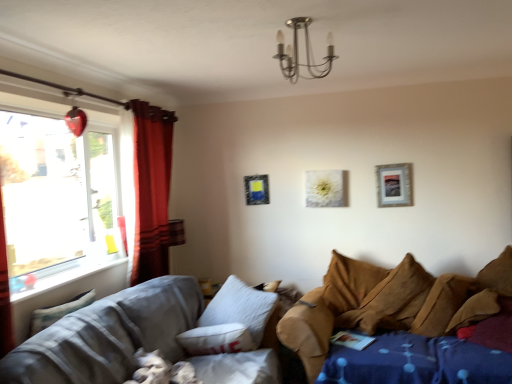
Locate an element on the screen. Image resolution: width=512 pixels, height=384 pixels. brown textured pillow at right, acting as the 1th pillow starting from the back is located at coordinates (498, 274).

Locate an element on the screen. The height and width of the screenshot is (384, 512). brown fabric couch at lower right, which is the first studio couch in right-to-left order is located at coordinates (388, 303).

The width and height of the screenshot is (512, 384). I want to click on white painted wood at left, so (x=68, y=276).

Identify the location of white matte canvas at center, which is the 1th picture frame in back-to-front order. (325, 188).

The height and width of the screenshot is (384, 512). What do you see at coordinates (151, 189) in the screenshot? I see `red velvet curtain at left` at bounding box center [151, 189].

Where is `silver metallic picture frame at upper right, the second picture frame positioned from the back`? silver metallic picture frame at upper right, the second picture frame positioned from the back is located at coordinates (394, 185).

Is textured gray fabric couch at lower left, which ranks as the 1th studio couch in left-to-right order, at the back of metallic chandelier at upper center?

No, metallic chandelier at upper center's orientation is not away from textured gray fabric couch at lower left, which ranks as the 1th studio couch in left-to-right order.

Is point (290, 64) behind point (249, 380)?

No.

What's the angular difference between metallic chandelier at upper center and textured gray fabric couch at lower left, which ranks as the 1th studio couch in left-to-right order,'s facing directions?

The angle between the facing direction of metallic chandelier at upper center and the facing direction of textured gray fabric couch at lower left, which ranks as the 1th studio couch in left-to-right order, is 0.819 degrees.

Can you confirm if metallic chandelier at upper center is bigger than textured gray fabric couch at lower left, which is counted as the 2th studio couch, starting from the right?

No.

Is brown textured pillow at right, acting as the 1th pillow starting from the back, wider or thinner than white matte canvas at center, which is the 1th picture frame in back-to-front order?

Considering their sizes, brown textured pillow at right, acting as the 1th pillow starting from the back, looks broader than white matte canvas at center, which is the 1th picture frame in back-to-front order.

Is brown textured pillow at right, which appears as the second pillow when viewed from the front, inside the boundaries of white matte canvas at center, arranged as the second picture frame when viewed from the front, or outside?

brown textured pillow at right, which appears as the second pillow when viewed from the front, lies outside white matte canvas at center, arranged as the second picture frame when viewed from the front.

Is brown textured pillow at right, acting as the 1th pillow starting from the back, smaller than white matte canvas at center, arranged as the second picture frame when viewed from the front?

Incorrect, brown textured pillow at right, acting as the 1th pillow starting from the back, is not smaller in size than white matte canvas at center, arranged as the second picture frame when viewed from the front.

Is brown textured pillow at right, the 1th pillow in the right-to-left sequence, turned away from white matte canvas at center, arranged as the second picture frame when viewed from the front?

No, brown textured pillow at right, the 1th pillow in the right-to-left sequence, is not facing away from white matte canvas at center, arranged as the second picture frame when viewed from the front.

Is white matte canvas at center, which ranks as the second picture frame in right-to-left order, bigger than brown textured pillow at right, marked as the 2th pillow in a left-to-right arrangement?

Actually, white matte canvas at center, which ranks as the second picture frame in right-to-left order, might be smaller than brown textured pillow at right, marked as the 2th pillow in a left-to-right arrangement.

From a real-world perspective, which is physically above, white matte canvas at center, which ranks as the second picture frame in right-to-left order, or brown textured pillow at right, acting as the 1th pillow starting from the back?

white matte canvas at center, which ranks as the second picture frame in right-to-left order.

How different are the orientations of white matte canvas at center, which ranks as the second picture frame in right-to-left order, and brown textured pillow at right, which appears as the second pillow when viewed from the front, in degrees?

They differ by 32.5 degrees in their facing directions.

Considering the relative sizes of white matte canvas at center, which is the 1th picture frame in left-to-right order, and brown textured pillow at right, marked as the 2th pillow in a left-to-right arrangement, in the image provided, is white matte canvas at center, which is the 1th picture frame in left-to-right order, shorter than brown textured pillow at right, marked as the 2th pillow in a left-to-right arrangement,?

Yes, white matte canvas at center, which is the 1th picture frame in left-to-right order, is shorter than brown textured pillow at right, marked as the 2th pillow in a left-to-right arrangement.

Is silver metallic picture frame at upper right, which ranks as the 1th picture frame in right-to-left order, aimed at textured gray fabric couch at lower left, which ranks as the 1th studio couch in left-to-right order?

No, silver metallic picture frame at upper right, which ranks as the 1th picture frame in right-to-left order, is not aimed at textured gray fabric couch at lower left, which ranks as the 1th studio couch in left-to-right order.

Is silver metallic picture frame at upper right, the second picture frame positioned from the back, not near textured gray fabric couch at lower left, which is counted as the 2th studio couch, starting from the right?

Yes, silver metallic picture frame at upper right, the second picture frame positioned from the back, is far from textured gray fabric couch at lower left, which is counted as the 2th studio couch, starting from the right.

Where is `the 1st studio couch below the silver metallic picture frame at upper right, the 1th picture frame positioned from the front (from a real-world perspective)`? This screenshot has width=512, height=384. the 1st studio couch below the silver metallic picture frame at upper right, the 1th picture frame positioned from the front (from a real-world perspective) is located at coordinates (130, 341).

Looking at their sizes, would you say silver metallic picture frame at upper right, the 1th picture frame positioned from the front, is wider or thinner than textured gray fabric couch at lower left, which is counted as the 2th studio couch, starting from the right?

Considering their sizes, silver metallic picture frame at upper right, the 1th picture frame positioned from the front, looks slimmer than textured gray fabric couch at lower left, which is counted as the 2th studio couch, starting from the right.

Is point (145, 123) more distant than point (56, 285)?

Yes, it is.

Based on their positions, is red velvet curtain at left located to the left or right of white painted wood at left?

red velvet curtain at left is to the right of white painted wood at left.

Where is `curtain above the white painted wood at left (from the image's perspective)`? The height and width of the screenshot is (384, 512). curtain above the white painted wood at left (from the image's perspective) is located at coordinates (151, 189).

Would you say red velvet curtain at left is outside white painted wood at left?

Yes, red velvet curtain at left is located beyond the bounds of white painted wood at left.

Can you confirm if brown fabric couch at lower right, which is the first studio couch in right-to-left order, is taller than silver metallic picture frame at upper right, the 1th picture frame positioned from the front?

Yes, brown fabric couch at lower right, which is the first studio couch in right-to-left order, is taller than silver metallic picture frame at upper right, the 1th picture frame positioned from the front.

Is silver metallic picture frame at upper right, placed as the second picture frame when sorted from left to right, at the back of brown fabric couch at lower right, arranged as the 2th studio couch when viewed from the left?

No, brown fabric couch at lower right, arranged as the 2th studio couch when viewed from the left, is not facing the opposite direction of silver metallic picture frame at upper right, placed as the second picture frame when sorted from left to right.

Considering the positions of points (336, 282) and (404, 169), is point (336, 282) farther from camera compared to point (404, 169)?

No, (336, 282) is in front of (404, 169).

Between brown fabric couch at lower right, which is the first studio couch in right-to-left order, and silver metallic picture frame at upper right, the second picture frame positioned from the back, which one appears on the right side from the viewer's perspective?

Positioned to the right is silver metallic picture frame at upper right, the second picture frame positioned from the back.

Which is behind, point (153, 121) or point (331, 189)?

The point (331, 189) is more distant.

From the image's perspective, is red velvet curtain at left located beneath white matte canvas at center, which ranks as the second picture frame in right-to-left order?

Indeed, from the image's perspective, red velvet curtain at left is shown beneath white matte canvas at center, which ranks as the second picture frame in right-to-left order.

From a real-world perspective, is red velvet curtain at left above or below white matte canvas at center, arranged as the second picture frame when viewed from the front?

red velvet curtain at left is situated higher than white matte canvas at center, arranged as the second picture frame when viewed from the front, in the real world.

Between red velvet curtain at left and white matte canvas at center, which is the 1th picture frame in left-to-right order, which one has smaller width?

white matte canvas at center, which is the 1th picture frame in left-to-right order, is thinner.

Find the location of a particular element. light fixture behind the textured gray fabric couch at lower left, which ranks as the 1th studio couch in left-to-right order is located at coordinates pos(305,52).

Locate an element on the screen. This screenshot has height=384, width=512. picture frame that is the 2nd object to the left of the brown textured pillow at right, acting as the 1th pillow starting from the back, starting at the anchor is located at coordinates (325, 188).

Which object lies nearer to the anchor point textured gray fabric couch at lower left, which is counted as the 2th studio couch, starting from the right, silver metallic picture frame at upper right, the second picture frame positioned from the back, or brown textured pillow at right, which appears as the second pillow when viewed from the front?

silver metallic picture frame at upper right, the second picture frame positioned from the back, is closer to textured gray fabric couch at lower left, which is counted as the 2th studio couch, starting from the right.

Which object lies nearer to the anchor point red velvet curtain at left, brown textured pillow at right, acting as the 1th pillow starting from the back, or metallic chandelier at upper center?

Among the two, metallic chandelier at upper center is located nearer to red velvet curtain at left.

Consider the image. Which object lies nearer to the anchor point white matte canvas at center, which is the 1th picture frame in back-to-front order, red velvet curtain at left or brown textured pillow at right, which appears as the second pillow when viewed from the front?

brown textured pillow at right, which appears as the second pillow when viewed from the front, is positioned closer to the anchor white matte canvas at center, which is the 1th picture frame in back-to-front order.

Looking at the image, which one is located closer to white painted wood at left, textured gray fabric couch at lower left, which ranks as the 1th studio couch in left-to-right order, or brown fabric couch at lower right, arranged as the 2th studio couch when viewed from the left?

The object closer to white painted wood at left is textured gray fabric couch at lower left, which ranks as the 1th studio couch in left-to-right order.

Based on their spatial positions, is metallic chandelier at upper center or textured gray fabric couch at lower left, which ranks as the 1th studio couch in left-to-right order, closer to brown textured pillow at right, marked as the 2th pillow in a left-to-right arrangement?

Based on the image, metallic chandelier at upper center appears to be nearer to brown textured pillow at right, marked as the 2th pillow in a left-to-right arrangement.

Looking at the image, which one is located further to red velvet curtain at left, metallic chandelier at upper center or silver metallic picture frame at upper right, the second picture frame positioned from the back?

silver metallic picture frame at upper right, the second picture frame positioned from the back, lies further to red velvet curtain at left than the other object.

From the image, which object appears to be nearer to white matte canvas at center, which is the 1th picture frame in back-to-front order, silver metallic picture frame at upper right, placed as the second picture frame when sorted from left to right, or metallic chandelier at upper center?

silver metallic picture frame at upper right, placed as the second picture frame when sorted from left to right, lies closer to white matte canvas at center, which is the 1th picture frame in back-to-front order, than the other object.

Which object lies further to the anchor point white matte canvas at center, which ranks as the second picture frame in right-to-left order, metallic chandelier at upper center or fluffy white pillow at lower left, marked as the 2th pillow in a right-to-left arrangement?

Among the two, fluffy white pillow at lower left, marked as the 2th pillow in a right-to-left arrangement, is located further to white matte canvas at center, which ranks as the second picture frame in right-to-left order.

The width and height of the screenshot is (512, 384). Find the location of `picture frame between fluffy white pillow at lower left, the first pillow in the left-to-right sequence, and brown fabric couch at lower right, which is the first studio couch in right-to-left order`. picture frame between fluffy white pillow at lower left, the first pillow in the left-to-right sequence, and brown fabric couch at lower right, which is the first studio couch in right-to-left order is located at coordinates (325, 188).

You are a GUI agent. You are given a task and a screenshot of the screen. Output one action in this format:
    pyautogui.click(x=<x>, y=<y>)
    Task: Click on the light fixture located between white painted wood at left and brown textured pillow at right, marked as the 2th pillow in a left-to-right arrangement, in the left-right direction
    This screenshot has width=512, height=384.
    Given the screenshot: What is the action you would take?
    pyautogui.click(x=305, y=52)

In order to click on picture frame between brown fabric couch at lower right, which is the first studio couch in right-to-left order, and white matte canvas at center, which ranks as the second picture frame in right-to-left order, from front to back in this screenshot , I will do `click(394, 185)`.

The height and width of the screenshot is (384, 512). I want to click on window sill between textured gray fabric couch at lower left, which ranks as the 1th studio couch in left-to-right order, and white matte canvas at center, which is the 1th picture frame in back-to-front order, from front to back, so click(68, 276).